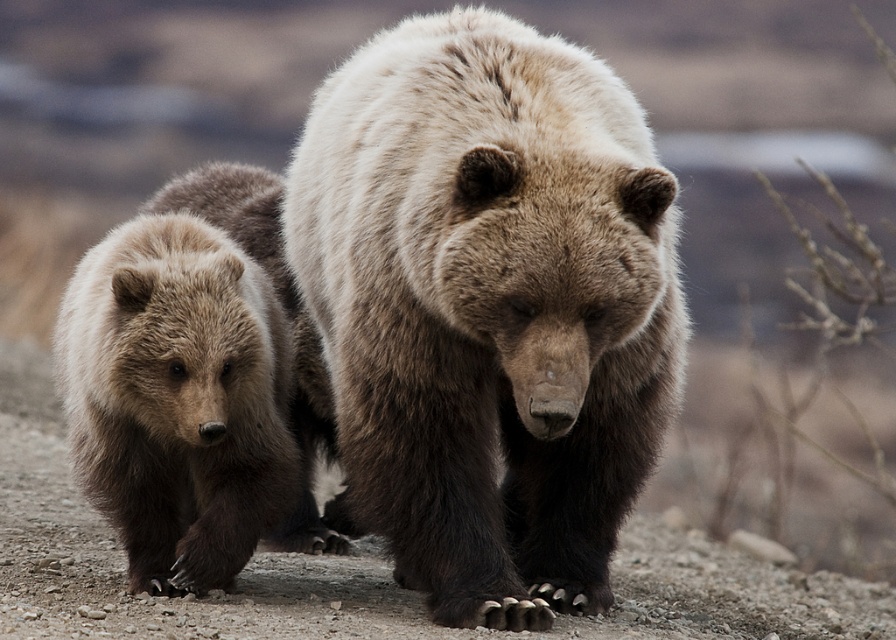
You are a wildlife photographer using a camera with a 50mm lens. You want to capture a close shot of the fuzzy brown bear at center. Given that the bear is 3.83 meters away from the camera, is this distance within the ideal focus range for a 50mm lens typically used for portraits?

The fuzzy brown bear at center is 3.83 meters away from the camera. For a 50mm lens commonly used in portrait photography, the ideal focus range for sharp portraits typically starts around 1 to 3 meters. Since 3.83 meters exceeds this range, the distance may be slightly beyond the optimal range for a close portrait shot, resulting in a less focused image.

You are a photographer who just took a picture of two bears in a rocky area. In the photo, you see a fuzzy brown bear at center and a fuzzy brown bear at left. Which bear is positioned to the right of the other?

The fuzzy brown bear at center is positioned to the right of the fuzzy brown bear at left.